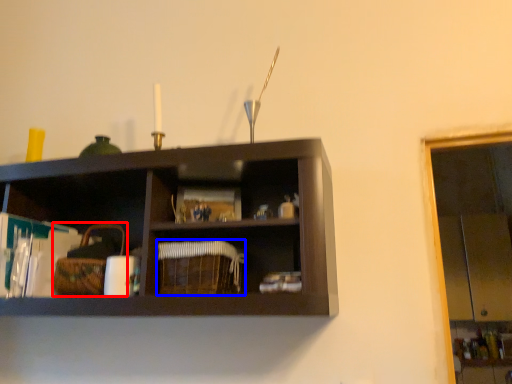
Question: Which of the following is the farthest to the observer, basket (highlighted by a red box) or basket (highlighted by a blue box)?

Choices:
 (A) basket
 (B) basket

Answer: (A)